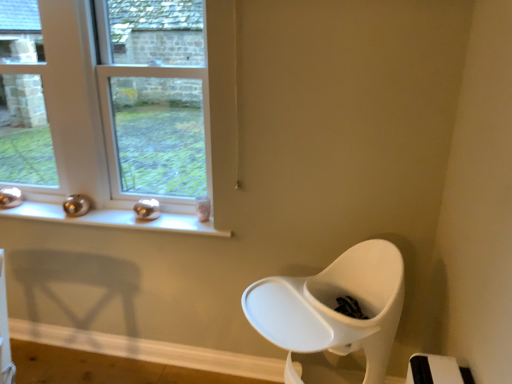
Question: Does clear glass window at upper left, which is the second window from left to right, have a smaller size compared to metallic silver window sill at upper left?

Choices:
 (A) yes
 (B) no

Answer: (B)

Question: Considering the relative sizes of clear glass window at upper left, which is the second window from left to right, and metallic silver window sill at upper left in the image provided, is clear glass window at upper left, which is the second window from left to right, taller than metallic silver window sill at upper left?

Choices:
 (A) yes
 (B) no

Answer: (A)

Question: From a real-world perspective, is clear glass window at upper left, which is the second window from left to right, under metallic silver window sill at upper left?

Choices:
 (A) yes
 (B) no

Answer: (B)

Question: Is clear glass window at upper left, positioned as the 1th window in right-to-left order, thinner than metallic silver window sill at upper left?

Choices:
 (A) yes
 (B) no

Answer: (A)

Question: Can you confirm if clear glass window at upper left, positioned as the 1th window in right-to-left order, is shorter than metallic silver window sill at upper left?

Choices:
 (A) yes
 (B) no

Answer: (B)

Question: Is clear glass window at upper left, which is the second window from left to right, at the left side of metallic silver window sill at upper left?

Choices:
 (A) yes
 (B) no

Answer: (B)

Question: Considering the relative positions of metallic silver window sill at upper left and clear glass window at upper left, which is the second window from left to right, in the image provided, is metallic silver window sill at upper left to the right of clear glass window at upper left, which is the second window from left to right, from the viewer's perspective?

Choices:
 (A) yes
 (B) no

Answer: (B)

Question: From the image's perspective, is metallic silver window sill at upper left above clear glass window at upper left, which is the second window from left to right?

Choices:
 (A) no
 (B) yes

Answer: (A)

Question: Is metallic silver window sill at upper left taller than clear glass window at upper left, positioned as the 1th window in right-to-left order?

Choices:
 (A) no
 (B) yes

Answer: (A)

Question: Is metallic silver window sill at upper left in contact with clear glass window at upper left, positioned as the 1th window in right-to-left order?

Choices:
 (A) no
 (B) yes

Answer: (A)

Question: Does metallic silver window sill at upper left have a lesser height compared to clear glass window at upper left, positioned as the 1th window in right-to-left order?

Choices:
 (A) yes
 (B) no

Answer: (A)

Question: From a real-world perspective, does metallic silver window sill at upper left stand above clear glass window at upper left, which is the second window from left to right?

Choices:
 (A) no
 (B) yes

Answer: (A)

Question: Can you confirm if clear glass window at upper left, which is the second window from left to right, is positioned to the right of clear glass window at left, arranged as the 2th window when viewed from the right?

Choices:
 (A) yes
 (B) no

Answer: (A)